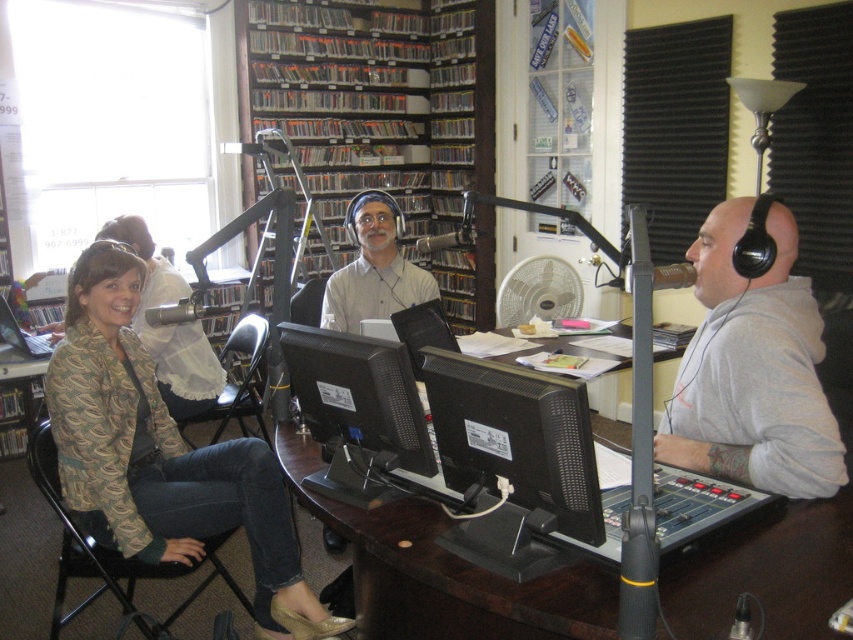
You are a guest entering the radio station studio and need to sit in the closest available seat to the microphone. There are two seats marked by points at coordinates point (381, 252) and point (422, 307). Which seat should you choose?

Point (381, 252) is further to the camera than point (422, 307), so the seat at point (422, 307) is closer to the microphone and should be chosen.

You are a technician entering the studio to adjust the white plastic fan at center and the black glossy monitor at center. Which object is located above the other?

The white plastic fan at center is positioned over the black glossy monitor at center, so the fan is above the monitor.

You are a guest entering the radio station studio and need to sit in a chair that is shorter than the black glossy monitor at center. Which chair should you choose between the matte gray shirt at center and the folding chair on the left?

The matte gray shirt at center is taller than the black glossy monitor at center, so the folding chair on the left is the shorter option. Choose the folding chair on the left.